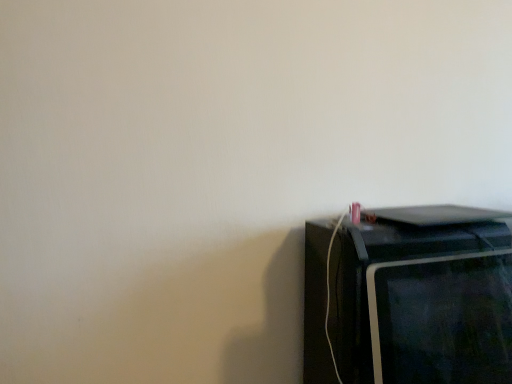
Question: Is the surface of black glossy microwave at right in direct contact with black glossy monitor at lower right?

Choices:
 (A) no
 (B) yes

Answer: (A)

Question: Is the position of black glossy microwave at right less distant than that of black glossy monitor at lower right?

Choices:
 (A) no
 (B) yes

Answer: (A)

Question: Is black glossy monitor at lower right inside black glossy microwave at right?

Choices:
 (A) yes
 (B) no

Answer: (B)

Question: Does black glossy microwave at right have a larger size compared to black glossy monitor at lower right?

Choices:
 (A) no
 (B) yes

Answer: (B)

Question: Is black glossy microwave at right positioned with its back to black glossy monitor at lower right?

Choices:
 (A) yes
 (B) no

Answer: (A)

Question: Is black glossy microwave at right thinner than black glossy monitor at lower right?

Choices:
 (A) yes
 (B) no

Answer: (B)

Question: Can you confirm if black glossy monitor at lower right is thinner than black glossy microwave at right?

Choices:
 (A) yes
 (B) no

Answer: (A)

Question: Can you confirm if black glossy monitor at lower right is taller than black glossy microwave at right?

Choices:
 (A) no
 (B) yes

Answer: (A)

Question: Is black glossy monitor at lower right outside black glossy microwave at right?

Choices:
 (A) yes
 (B) no

Answer: (A)

Question: Is black glossy monitor at lower right aimed at black glossy microwave at right?

Choices:
 (A) yes
 (B) no

Answer: (A)

Question: Is black glossy monitor at lower right at the left side of black glossy microwave at right?

Choices:
 (A) yes
 (B) no

Answer: (B)

Question: Considering the relative sizes of black glossy monitor at lower right and black glossy microwave at right in the image provided, is black glossy monitor at lower right wider than black glossy microwave at right?

Choices:
 (A) no
 (B) yes

Answer: (A)

Question: Would you say black glossy microwave at right is inside or outside black glossy monitor at lower right?

Choices:
 (A) outside
 (B) inside

Answer: (A)